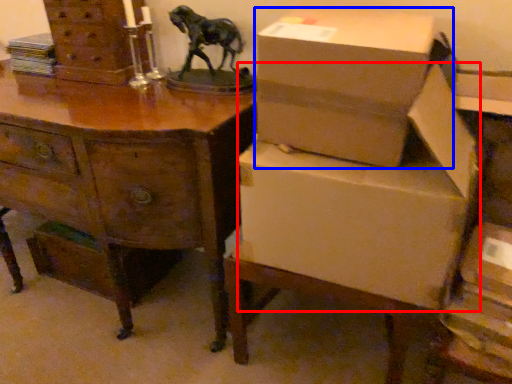
Question: Which point is further to the camera, cardboard box (highlighted by a red box) or box (highlighted by a blue box)?

Choices:
 (A) cardboard box
 (B) box

Answer: (A)